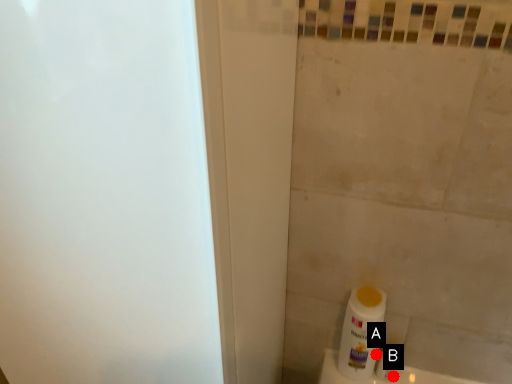
Question: Two points are circled on the image, labeled by A and B beside each circle. Which of the following is the closest to the observer?

Choices:
 (A) A is closer
 (B) B is closer

Answer: (A)